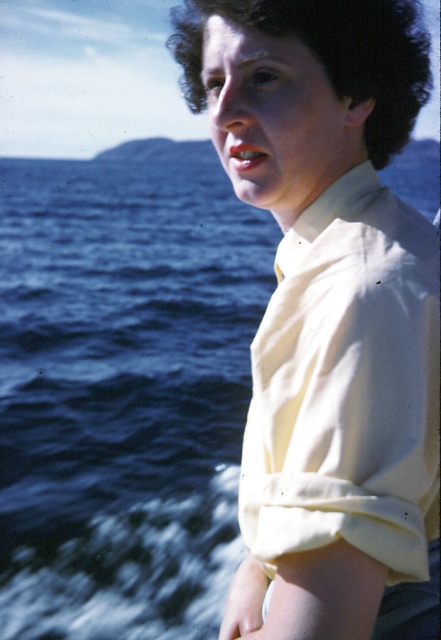
You are a photographer positioned at the camera. You want to take a closeup shot of the point at coordinates point (355,428). Can you reach it with your camera lens without moving your position?

The distance between point (355,428) and the camera is 1.09 meters, so yes, the photographer can reach it with the camera lens without moving from the current position since the distance is within the lens range.

You are a photographer trying to capture the scene. You notice the white cotton shirt at right is represented by point (347, 385). Where should you position your camera to ensure the shirt is centered in the photo?

To center the white cotton shirt at right represented by point (347, 385), position the camera so that the point (347, 385) aligns with the center of the frame.

You are a photographer trying to capture both the white matte shirt at upper right and the white cotton shirt at right in a single shot. Which shirt should you focus on first to ensure both are in focus?

You should focus on the white matte shirt at upper right first because it is closer to you than the white cotton shirt at right, ensuring both will be in focus when using a camera with depth of field considerations.